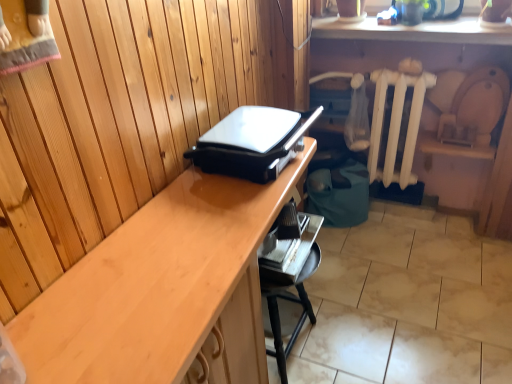
At what (x,y) coordinates should I click in order to perform the action: click on empty space that is ontop of wooden desk at center (from a real-world perspective). Please return your answer as a coordinate pair (x, y). This screenshot has height=384, width=512. Looking at the image, I should click on (196, 238).